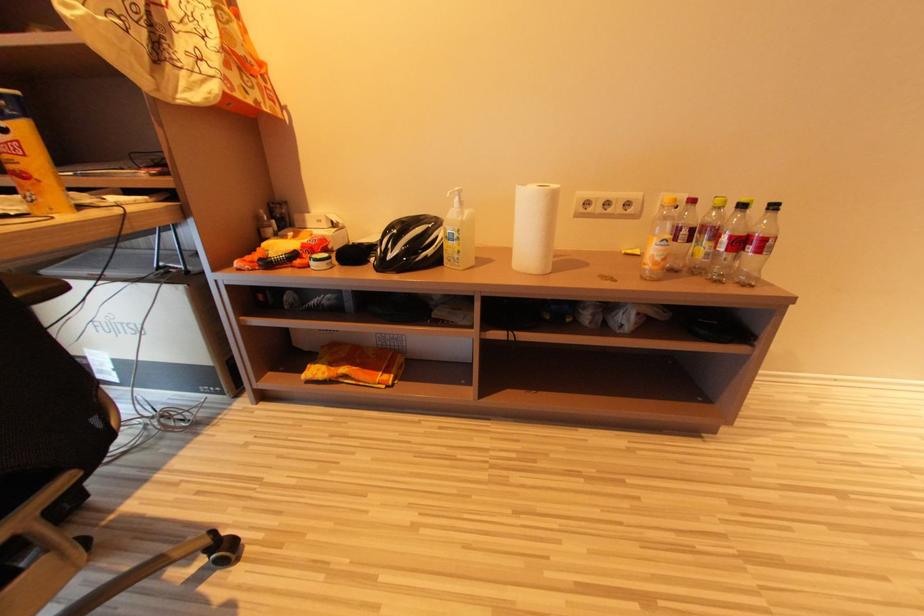
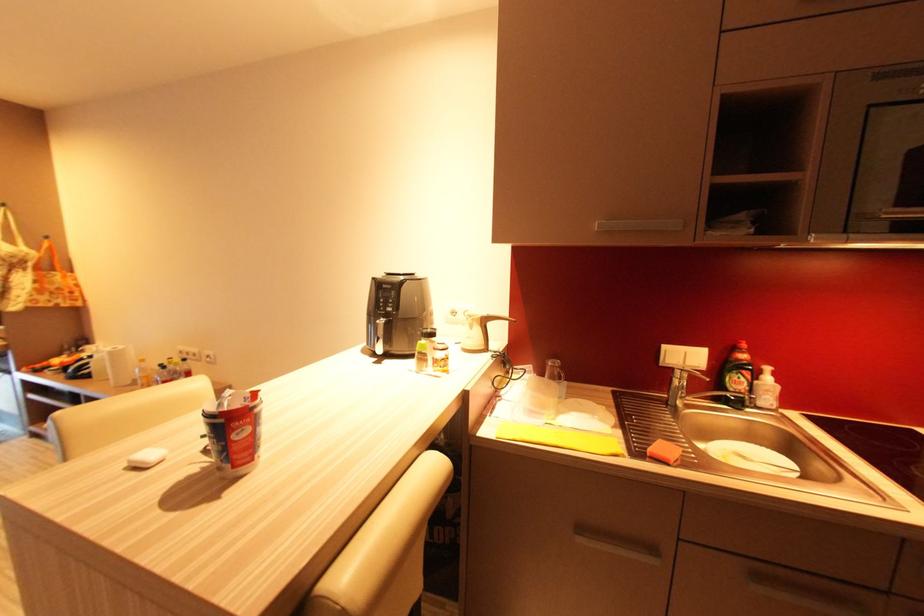
Question: The images are taken continuously from a first-person perspective. In which direction are you moving?

Choices:
 (A) Left
 (B) Right
 (C) Forward
 (D) Backward

Answer: (B)